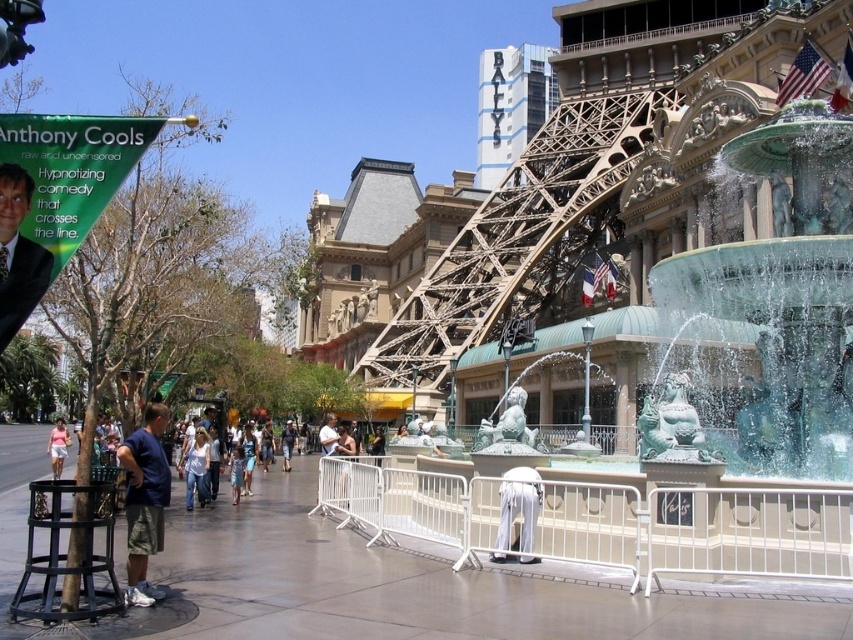
Question: Based on their relative distances, which object is nearer to the white fabric pants at center?

Choices:
 (A) blue cotton shirt at center
 (B) translucent glass fountain at center right
 (C) matte black suit at left

Answer: (B)

Question: From the image, what is the correct spatial relationship of translucent glass fountain at center right in relation to denim jeans at center?

Choices:
 (A) right
 (B) left

Answer: (A)

Question: Estimate the real-world distances between objects in this image. Which object is closer to the light pink cotton shirt at center?

Choices:
 (A) denim jeans at center
 (B) white fabric pants at center
 (C) blue cotton shirt at center

Answer: (A)

Question: Which of the following is the farthest from the observer?

Choices:
 (A) (515, 506)
 (B) (152, 406)
 (C) (51, 477)

Answer: (C)

Question: Can you confirm if translucent glass fountain at center right is positioned to the left of denim jeans at center?

Choices:
 (A) yes
 (B) no

Answer: (B)

Question: Can you confirm if white fabric pants at center is wider than denim jeans at center?

Choices:
 (A) no
 (B) yes

Answer: (A)